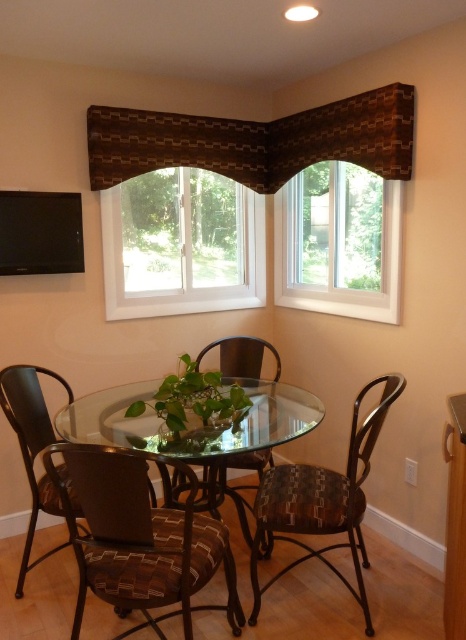
Does brown textured valance at upper center have a greater height compared to woven fabric chair at center?

Indeed, brown textured valance at upper center has a greater height compared to woven fabric chair at center.

Is brown textured valance at upper center wider than woven fabric chair at center?

Yes, brown textured valance at upper center is wider than woven fabric chair at center.

Does point (395, 147) come farther from viewer compared to point (246, 364)?

No, it is in front of (246, 364).

Find the location of a particular element. Image resolution: width=466 pixels, height=640 pixels. brown textured valance at upper center is located at coordinates (255, 140).

Is brown textured valance at upper center closer to the viewer compared to patterned fabric chair at center?

No.

What do you see at coordinates (255, 140) in the screenshot? I see `brown textured valance at upper center` at bounding box center [255, 140].

Where is `brown textured valance at upper center`? brown textured valance at upper center is located at coordinates (255, 140).

Is metallic brown chair at lower left below woven fabric chair at center?

No.

Between point (81, 513) and point (249, 456), which one is positioned behind?

Positioned behind is point (249, 456).

Which is in front, point (2, 378) or point (265, 550)?

Positioned in front is point (2, 378).

You are a GUI agent. You are given a task and a screenshot of the screen. Output one action in this format:
    pyautogui.click(x=<x>, y=<y>)
    Task: Click on the metallic brown chair at lower left
    The height and width of the screenshot is (640, 466).
    Given the screenshot: What is the action you would take?
    pyautogui.click(x=32, y=445)